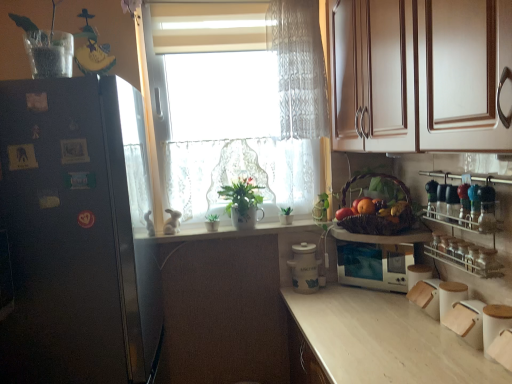
Question: Does shiny red apple at right, the first fruit viewed from the left, lie in front of black matte refrigerator at left?

Choices:
 (A) yes
 (B) no

Answer: (B)

Question: Is shiny red apple at right, the first fruit viewed from the left, oriented away from black matte refrigerator at left?

Choices:
 (A) yes
 (B) no

Answer: (B)

Question: Is shiny red apple at right, the first fruit viewed from the left, at the left side of black matte refrigerator at left?

Choices:
 (A) no
 (B) yes

Answer: (A)

Question: Is shiny red apple at right, which is the 3th fruit in right-to-left order, not close to black matte refrigerator at left?

Choices:
 (A) yes
 (B) no

Answer: (A)

Question: Are shiny red apple at right, the first fruit viewed from the left, and black matte refrigerator at left beside each other?

Choices:
 (A) yes
 (B) no

Answer: (B)

Question: Is white ceramic pots at center spatially inside white ceramic jar at center, which ranks as the 2th appliance in right-to-left order, or outside of it?

Choices:
 (A) inside
 (B) outside

Answer: (B)

Question: From a real-world perspective, is white ceramic pots at center physically located above or below white ceramic jar at center, which ranks as the 2th appliance in right-to-left order?

Choices:
 (A) below
 (B) above

Answer: (B)

Question: From the image's perspective, is white ceramic pots at center above or below white ceramic jar at center, which ranks as the 2th appliance in right-to-left order?

Choices:
 (A) above
 (B) below

Answer: (A)

Question: Relative to white ceramic jar at center, marked as the 1th appliance in a left-to-right arrangement, is white ceramic pots at center in front or behind?

Choices:
 (A) front
 (B) behind

Answer: (B)

Question: Do you think white ceramic pots at center is within green matte houseplant at center, the third houseplant when ordered from right to left, or outside of it?

Choices:
 (A) inside
 (B) outside

Answer: (B)

Question: From the image's perspective, relative to green matte houseplant at center, the 1th houseplant viewed from the left, is white ceramic pots at center above or below?

Choices:
 (A) below
 (B) above

Answer: (A)

Question: In terms of size, does white ceramic pots at center appear bigger or smaller than green matte houseplant at center, the third houseplant when ordered from right to left?

Choices:
 (A) big
 (B) small

Answer: (A)

Question: Does point (245, 235) appear closer or farther from the camera than point (208, 228)?

Choices:
 (A) farther
 (B) closer

Answer: (A)

Question: Is green matte houseplant at center, the third houseplant when ordered from right to left, inside the boundaries of green matte houseplant at center, which is counted as the third houseplant, starting from the left, or outside?

Choices:
 (A) inside
 (B) outside

Answer: (B)

Question: From their relative heights in the image, would you say green matte houseplant at center, the third houseplant when ordered from right to left, is taller or shorter than green matte houseplant at center, the 1th houseplant viewed from the right?

Choices:
 (A) tall
 (B) short

Answer: (B)